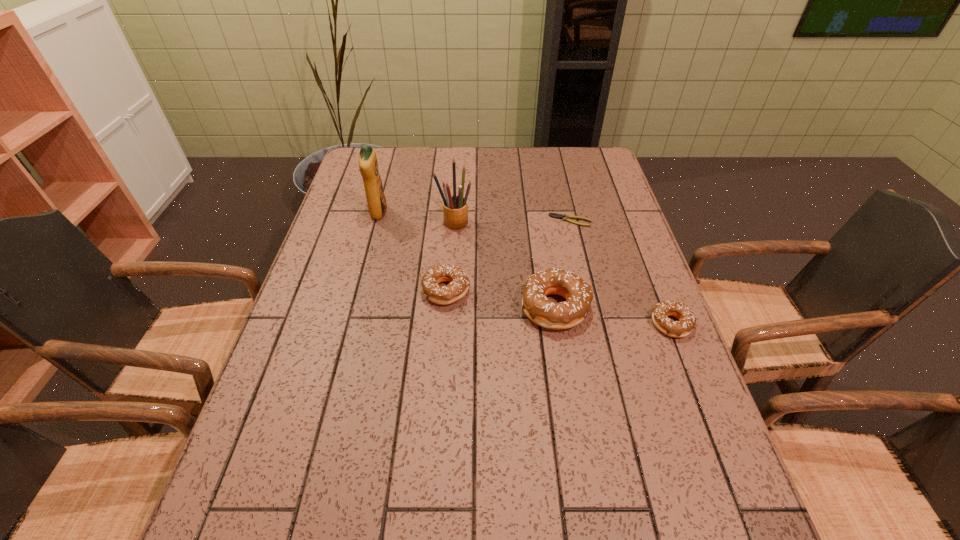
Image resolution: width=960 pixels, height=540 pixels. In order to click on free space at the near edge of the desktop in this screenshot , I will do `click(509, 462)`.

Find the location of a particular element. The width and height of the screenshot is (960, 540). vacant space at the left edge of the desktop is located at coordinates (336, 323).

At what (x,y) coordinates should I click in order to perform the action: click on free space at the right edge. Please return your answer as a coordinate pair (x, y). This screenshot has width=960, height=540. Looking at the image, I should click on (583, 239).

Find the location of a particular element. vacant space at the far left corner of the desktop is located at coordinates (359, 177).

At what (x,y) coordinates should I click in order to perform the action: click on free spot at the far right corner of the desktop. Please return your answer as a coordinate pair (x, y). The height and width of the screenshot is (540, 960). Looking at the image, I should click on (600, 158).

Find the location of `vacant space in between the shortest object and the rightmost doughnut`. vacant space in between the shortest object and the rightmost doughnut is located at coordinates (621, 272).

Locate an element on the screen. The height and width of the screenshot is (540, 960). empty space that is in between the tallest doughnut and the rightmost doughnut is located at coordinates (613, 315).

Identify the location of unoccupied area between the pliers and the pencil box. coord(513,221).

The width and height of the screenshot is (960, 540). In order to click on free space between the leftmost doughnut and the tallest doughnut in this screenshot , I will do `click(500, 299)`.

Image resolution: width=960 pixels, height=540 pixels. What are the coordinates of `unoccupied area between the third tallest object and the fifth shortest object` in the screenshot? It's located at (505, 264).